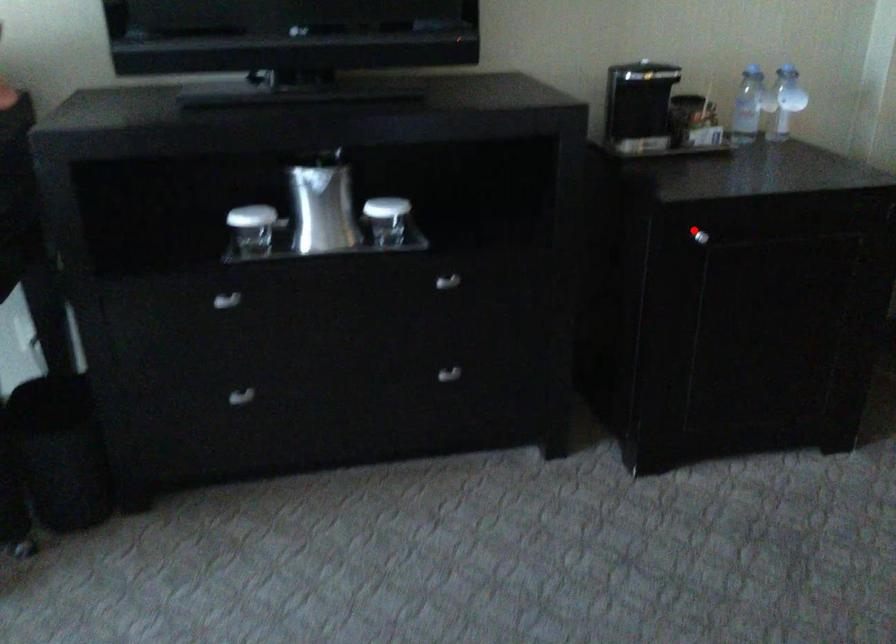
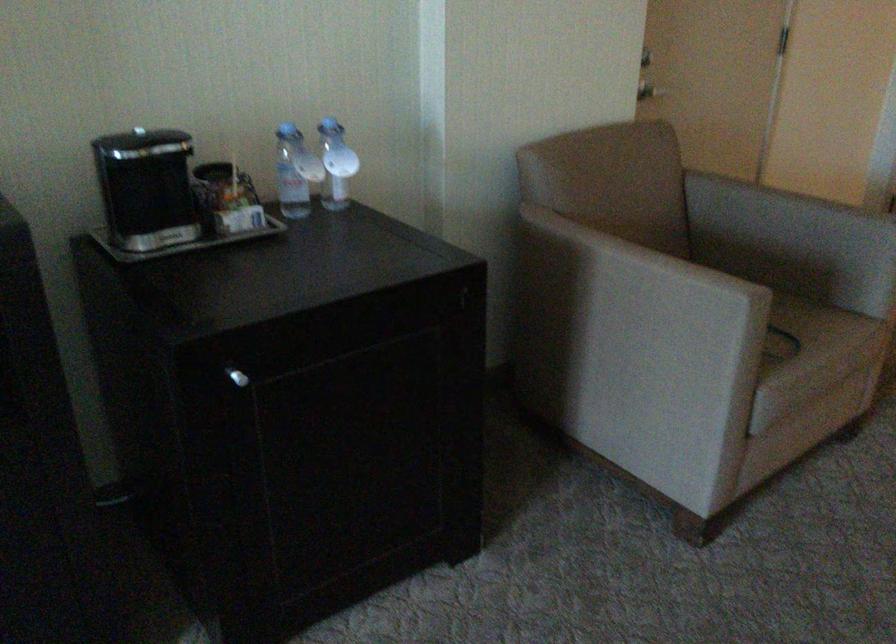
Question: A red point is marked in image1. In image2, is the corresponding 3D point closer to the camera or farther? Reply with the corresponding letter.

Choices:
 (A) The corresponding 3D point is closer.
 (B) The corresponding 3D point is farther.

Answer: (A)